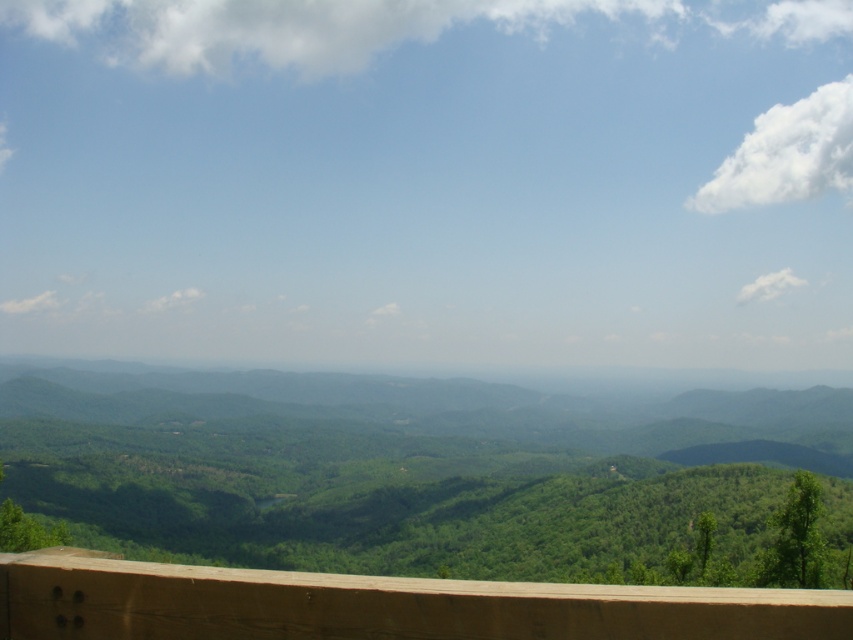
Question: Can you confirm if green matte forest at center is positioned to the left of brown wooden ledge at lower center?

Choices:
 (A) yes
 (B) no

Answer: (A)

Question: Can you confirm if green matte forest at center is thinner than brown wooden ledge at lower center?

Choices:
 (A) yes
 (B) no

Answer: (B)

Question: Does green matte forest at center have a larger size compared to brown wooden ledge at lower center?

Choices:
 (A) no
 (B) yes

Answer: (B)

Question: Among these objects, which one is nearest to the camera?

Choices:
 (A) brown wooden ledge at lower center
 (B) green matte forest at center

Answer: (A)

Question: Which of the following is the farthest from the observer?

Choices:
 (A) green matte forest at center
 (B) brown wooden ledge at lower center

Answer: (A)

Question: Which object is closer to the camera taking this photo?

Choices:
 (A) green matte forest at center
 (B) brown wooden ledge at lower center

Answer: (B)